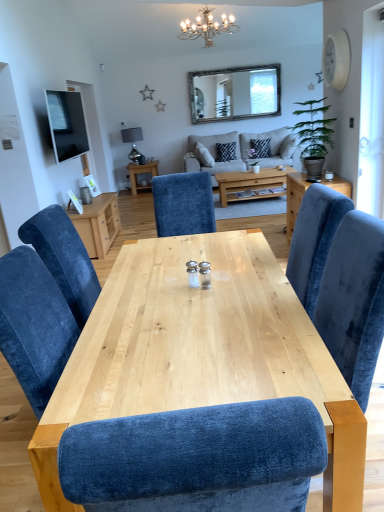
Question: In terms of height, does natural wood coffee table at center look taller or shorter compared to black textured pillow at center?

Choices:
 (A) short
 (B) tall

Answer: (B)

Question: From the image's perspective, relative to black textured pillow at center, is natural wood coffee table at center above or below?

Choices:
 (A) above
 (B) below

Answer: (B)

Question: Considering the real-world distances, which object is closest to the natural wood coffee table at center?

Choices:
 (A) black textured pillow at center
 (B) light gray fabric couch at center
 (C) matte black tv at upper left
 (D) light wood table at center, acting as the 3th table starting from the front
 (E) green leafy plant at right

Answer: (E)

Question: Estimate the real-world distances between objects in this image. Which object is closer to the light gray fabric couch at center?

Choices:
 (A) green leafy plant at right
 (B) natural wood table at center, the second table in the left-to-right sequence
 (C) velvet blue chair at right, the 2th table in the top-to-bottom sequence
 (D) light wood table at center, which appears as the third table when viewed from the right
 (E) natural wood coffee table at center

Answer: (A)